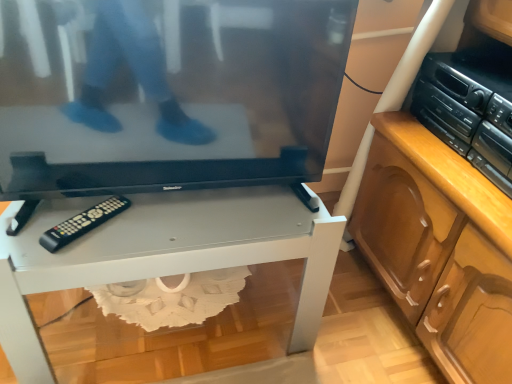
Question: Does black plastic stereo at right have a lesser height compared to black plastic remote at lower left?

Choices:
 (A) yes
 (B) no

Answer: (B)

Question: Can you confirm if black plastic stereo at right is positioned to the left of black plastic remote at lower left?

Choices:
 (A) no
 (B) yes

Answer: (A)

Question: Considering the relative sizes of black plastic stereo at right and black plastic remote at lower left in the image provided, is black plastic stereo at right smaller than black plastic remote at lower left?

Choices:
 (A) no
 (B) yes

Answer: (A)

Question: Considering the relative positions of black plastic stereo at right and black plastic remote at lower left in the image provided, is black plastic stereo at right to the right of black plastic remote at lower left from the viewer's perspective?

Choices:
 (A) no
 (B) yes

Answer: (B)

Question: Is black plastic stereo at right looking in the opposite direction of black plastic remote at lower left?

Choices:
 (A) yes
 (B) no

Answer: (B)

Question: Visually, is black plastic stereo at right positioned to the left or to the right of white glossy desk at center?

Choices:
 (A) right
 (B) left

Answer: (A)

Question: From the image's perspective, is black plastic stereo at right located above or below white glossy desk at center?

Choices:
 (A) below
 (B) above

Answer: (B)

Question: Is black plastic stereo at right situated inside white glossy desk at center or outside?

Choices:
 (A) outside
 (B) inside

Answer: (A)

Question: Is black plastic stereo at right taller or shorter than white glossy desk at center?

Choices:
 (A) short
 (B) tall

Answer: (A)

Question: Considering their positions, is black glossy television at center located in front of or behind black plastic remote at lower left?

Choices:
 (A) behind
 (B) front

Answer: (B)

Question: From the image's perspective, is black glossy television at center above or below black plastic remote at lower left?

Choices:
 (A) below
 (B) above

Answer: (B)

Question: From a real-world perspective, relative to black plastic remote at lower left, is black glossy television at center vertically above or below?

Choices:
 (A) above
 (B) below

Answer: (A)

Question: Considering the relative positions of black glossy television at center and black plastic remote at lower left in the image provided, is black glossy television at center to the left or to the right of black plastic remote at lower left?

Choices:
 (A) left
 (B) right

Answer: (B)

Question: In terms of height, does black glossy television at center look taller or shorter compared to black plastic stereo at right?

Choices:
 (A) short
 (B) tall

Answer: (B)

Question: From a real-world perspective, is black glossy television at center positioned above or below black plastic stereo at right?

Choices:
 (A) above
 (B) below

Answer: (A)